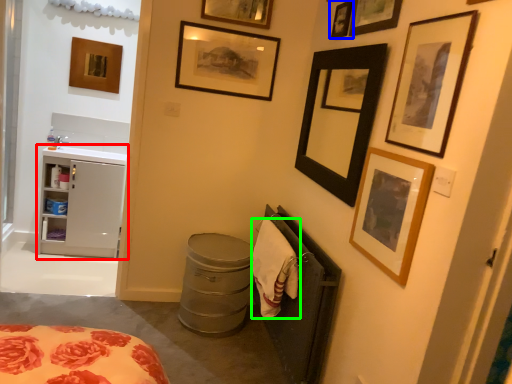
Question: Estimate the real-world distances between objects in this image. Which object is farther from cabinetry (highlighted by a red box), picture frame (highlighted by a blue box) or cloth (highlighted by a green box)?

Choices:
 (A) picture frame
 (B) cloth

Answer: (A)